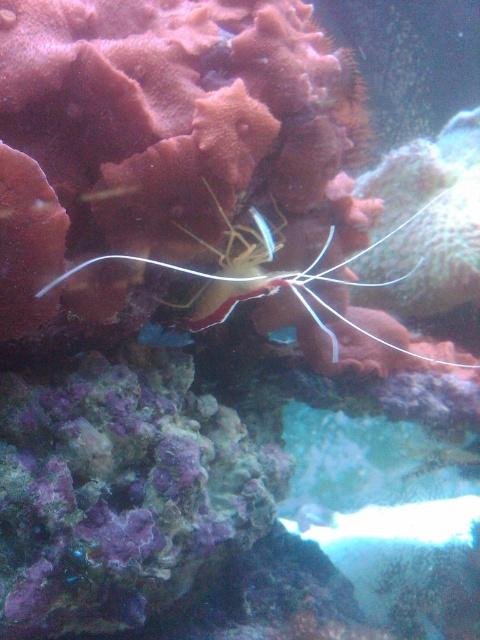
Question: Does translucent white shrimp at center have a smaller size compared to translucent white fish at center?

Choices:
 (A) no
 (B) yes

Answer: (A)

Question: Can you confirm if translucent white shrimp at center is smaller than translucent white fish at center?

Choices:
 (A) yes
 (B) no

Answer: (B)

Question: Which of the following is the closest to the observer?

Choices:
 (A) (145, 342)
 (B) (421, 211)
 (C) (302, 531)

Answer: (A)

Question: Estimate the real-world distances between objects in this image. Which object is closer to the shiny blue fish at center?

Choices:
 (A) translucent white fish at center
 (B) translucent white shrimp at center

Answer: (B)

Question: Which point is farther from the camera taking this photo?

Choices:
 (A) (274, 280)
 (B) (334, 518)

Answer: (B)

Question: Does translucent white shrimp at center appear under translucent white fish at center?

Choices:
 (A) no
 (B) yes

Answer: (A)